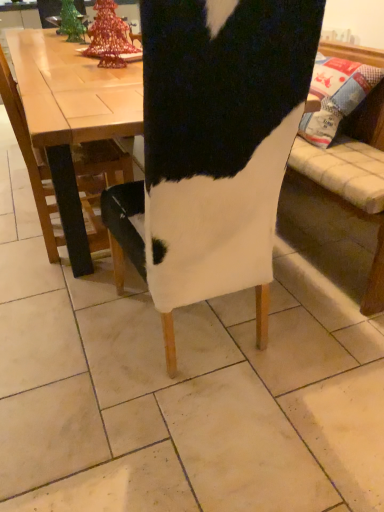
Question: From the image's perspective, is white fabric chair at center, the second chair viewed from the left, under white fabric chair at left, the 1th chair in the left-to-right sequence?

Choices:
 (A) yes
 (B) no

Answer: (A)

Question: Is white fabric chair at center, the second chair viewed from the left, smaller than white fabric chair at left, the 1th chair in the left-to-right sequence?

Choices:
 (A) yes
 (B) no

Answer: (B)

Question: Is white fabric chair at center, the second chair viewed from the left, completely or partially outside of white fabric chair at left, the second chair in the right-to-left sequence?

Choices:
 (A) yes
 (B) no

Answer: (A)

Question: Does white fabric chair at center, the 1th chair positioned from the right, have a larger size compared to white fabric chair at left, the second chair in the right-to-left sequence?

Choices:
 (A) yes
 (B) no

Answer: (A)

Question: From a real-world perspective, is white fabric chair at center, the 1th chair positioned from the right, below white fabric chair at left, the second chair in the right-to-left sequence?

Choices:
 (A) yes
 (B) no

Answer: (B)

Question: Does white fabric chair at center, the 1th chair positioned from the right, have a greater height compared to white fabric chair at left, the 1th chair in the left-to-right sequence?

Choices:
 (A) no
 (B) yes

Answer: (B)

Question: Is white fabric chair at left, the 1th chair in the left-to-right sequence, taller than white fabric chair at center, the 1th chair positioned from the right?

Choices:
 (A) no
 (B) yes

Answer: (A)

Question: Is white fabric chair at left, the second chair in the right-to-left sequence, at the left side of white fabric chair at center, the second chair viewed from the left?

Choices:
 (A) no
 (B) yes

Answer: (B)

Question: Would you say white fabric chair at center, the second chair viewed from the left, is part of white fabric chair at left, the 1th chair in the left-to-right sequence,'s contents?

Choices:
 (A) yes
 (B) no

Answer: (B)

Question: Is white fabric chair at left, the 1th chair in the left-to-right sequence, looking in the opposite direction of white fabric chair at center, the second chair viewed from the left?

Choices:
 (A) no
 (B) yes

Answer: (A)

Question: Is white fabric chair at left, the 1th chair in the left-to-right sequence, bigger than white fabric chair at center, the second chair viewed from the left?

Choices:
 (A) no
 (B) yes

Answer: (A)

Question: Is white fabric chair at left, the second chair in the right-to-left sequence, outside of white fabric chair at center, the second chair viewed from the left?

Choices:
 (A) yes
 (B) no

Answer: (A)

Question: Relative to white fabric chair at left, the 1th chair in the left-to-right sequence, is white fabric chair at center, the 1th chair positioned from the right, in front or behind?

Choices:
 (A) behind
 (B) front

Answer: (B)